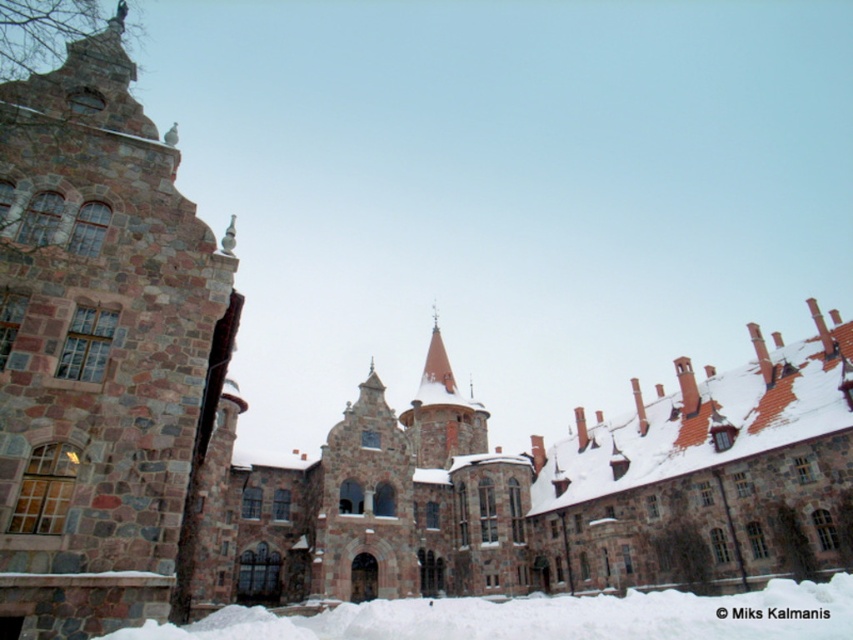
Is rustic stone tower at left to the right of white fluffy snow at lower center from the viewer's perspective?

No, rustic stone tower at left is not to the right of white fluffy snow at lower center.

Which is in front, point (6, 288) or point (180, 637)?

Point (180, 637) is more forward.

Does point (138, 244) lie behind point (611, 602)?

No.

The image size is (853, 640). I want to click on rustic stone tower at left, so click(102, 352).